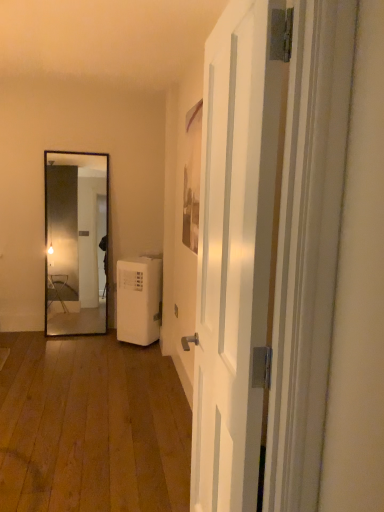
Where is `free space in front of white plastic water heater at lower center`? This screenshot has height=512, width=384. free space in front of white plastic water heater at lower center is located at coordinates (118, 353).